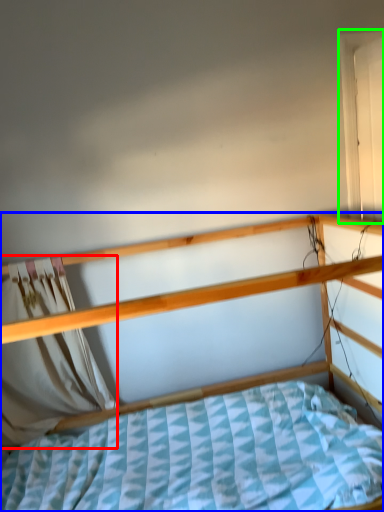
Question: Which object is the farthest from curtain (highlighted by a red box)? Choose among these: bed (highlighted by a blue box) or window (highlighted by a green box).

Choices:
 (A) bed
 (B) window

Answer: (B)